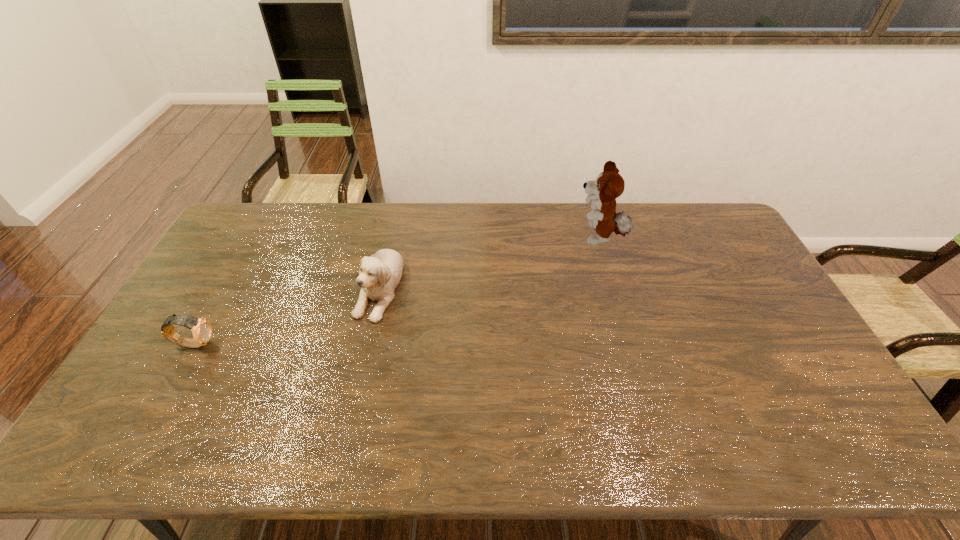
Locate an element on the screen. This screenshot has height=540, width=960. blank region between the leftmost object and the rightmost object is located at coordinates (397, 291).

Find the location of a particular element. The width and height of the screenshot is (960, 540). free space between the taller puppy and the shorter puppy is located at coordinates (489, 262).

The width and height of the screenshot is (960, 540). In order to click on free space between the left puppy and the watch in this screenshot , I will do `click(286, 315)`.

Image resolution: width=960 pixels, height=540 pixels. Find the location of `free space between the tallest object and the leftmost object`. free space between the tallest object and the leftmost object is located at coordinates (397, 291).

Where is `free spot between the watch and the second object from left to right`? The image size is (960, 540). free spot between the watch and the second object from left to right is located at coordinates (286, 315).

Locate an element on the screen. The image size is (960, 540). blank region between the rightmost object and the shortest object is located at coordinates (397, 291).

Locate an element on the screen. Image resolution: width=960 pixels, height=540 pixels. vacant point located between the shortest object and the second object from left to right is located at coordinates (286, 315).

The width and height of the screenshot is (960, 540). Find the location of `vacant area between the shortest object and the shorter puppy`. vacant area between the shortest object and the shorter puppy is located at coordinates (286, 315).

Where is `vacant space that's between the second object from left to right and the shortest object`? The width and height of the screenshot is (960, 540). vacant space that's between the second object from left to right and the shortest object is located at coordinates (286, 315).

This screenshot has height=540, width=960. Find the location of `object that can be found as the closest to the leftmost object`. object that can be found as the closest to the leftmost object is located at coordinates pyautogui.click(x=379, y=275).